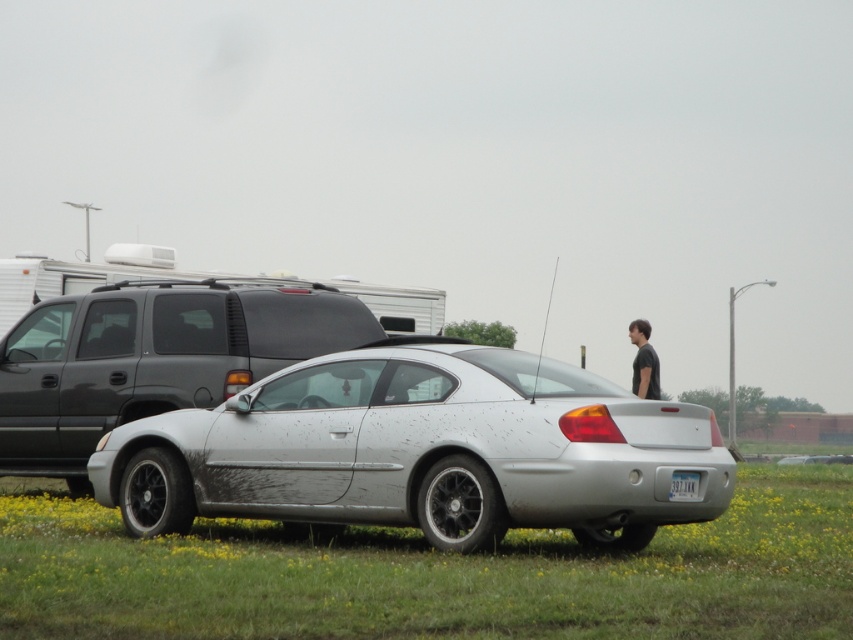
Question: Which object appears farthest from the camera in this image?

Choices:
 (A) matte black suv at center
 (B) white plastic license plate at center
 (C) silver metallic sedan at center
 (D) green grass at lower center

Answer: (A)

Question: Can you confirm if matte black suv at center is positioned above white plastic license plate at center?

Choices:
 (A) yes
 (B) no

Answer: (A)

Question: Which point is farther from the camera taking this photo?

Choices:
 (A) (x=618, y=611)
 (B) (x=634, y=321)
 (C) (x=347, y=408)
 (D) (x=669, y=492)

Answer: (B)

Question: Is green grass at lower center to the left of dark gray shirt at right from the viewer's perspective?

Choices:
 (A) yes
 (B) no

Answer: (A)

Question: Which of these objects is positioned closest to the dark gray shirt at right?

Choices:
 (A) white plastic license plate at center
 (B) green grass at lower center

Answer: (A)

Question: Does green grass at lower center have a larger size compared to dark gray shirt at right?

Choices:
 (A) yes
 (B) no

Answer: (A)